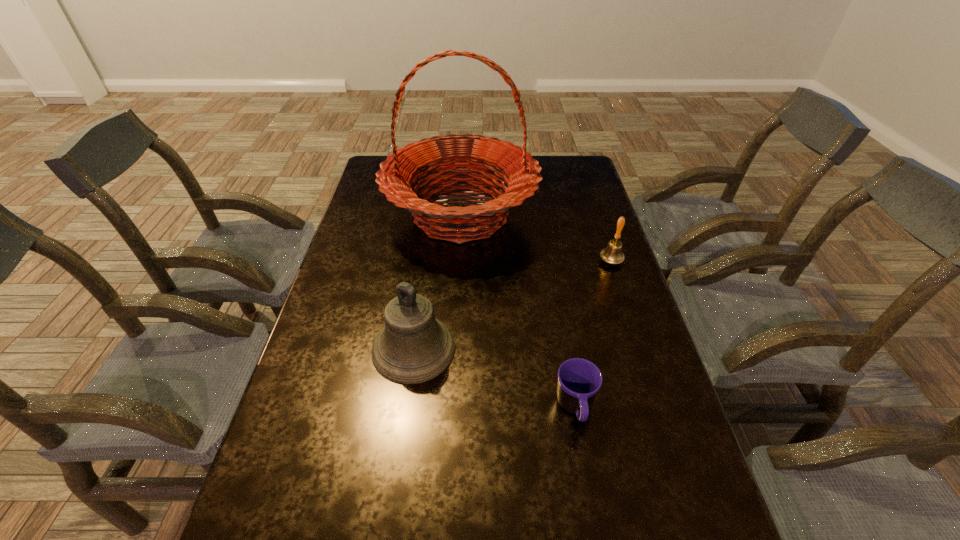
Locate an element on the screen. The width and height of the screenshot is (960, 540). the closest object to the rightmost object is located at coordinates (400, 171).

Where is `free spot that satisfies the following two spatial constraints: 1. on the back side of the left bell; 2. on the right side of the tallest object`? The height and width of the screenshot is (540, 960). free spot that satisfies the following two spatial constraints: 1. on the back side of the left bell; 2. on the right side of the tallest object is located at coordinates (432, 215).

This screenshot has width=960, height=540. I want to click on free location that satisfies the following two spatial constraints: 1. on the back side of the basket; 2. on the left side of the second tallest object, so click(432, 215).